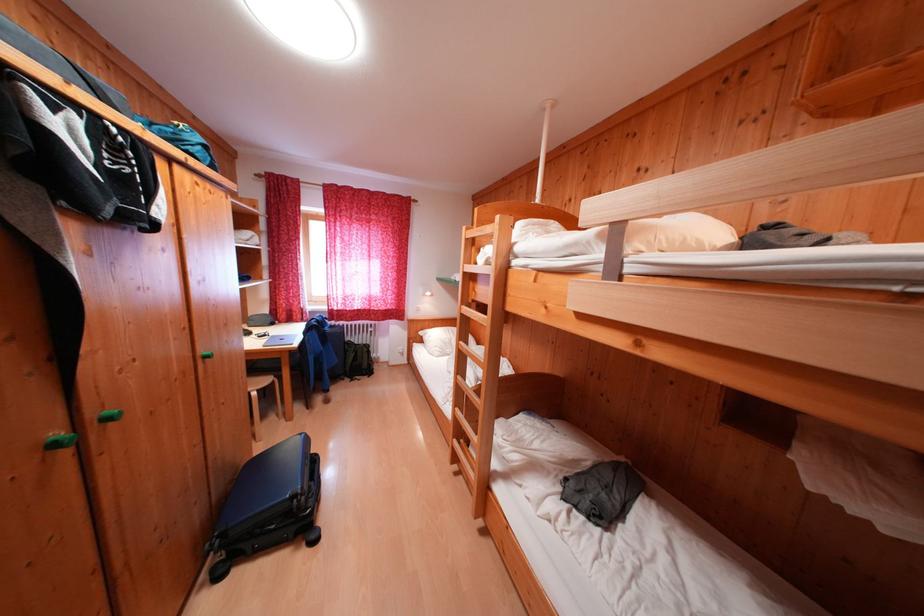
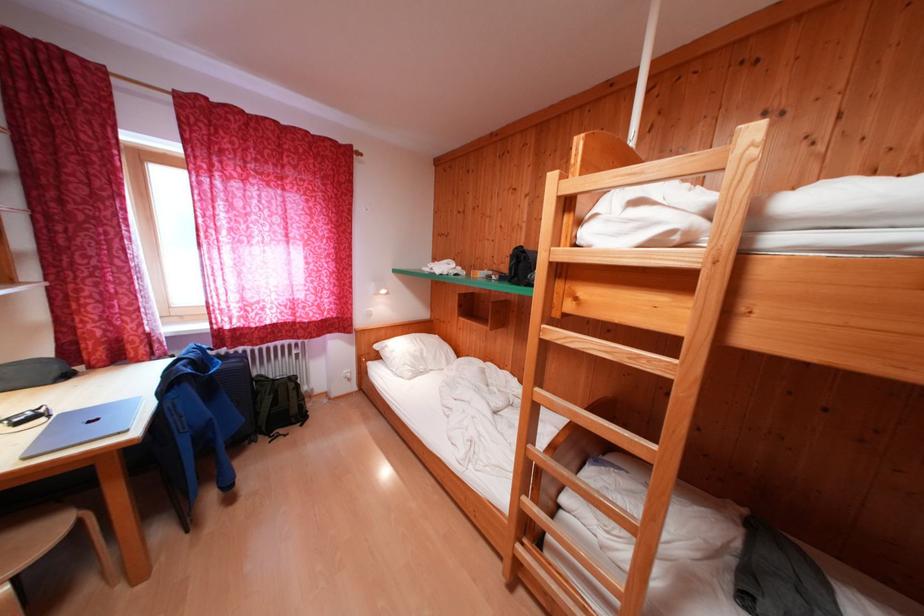
Where in the second image is the point corresponding to point (292, 346) from the first image?

(104, 434)